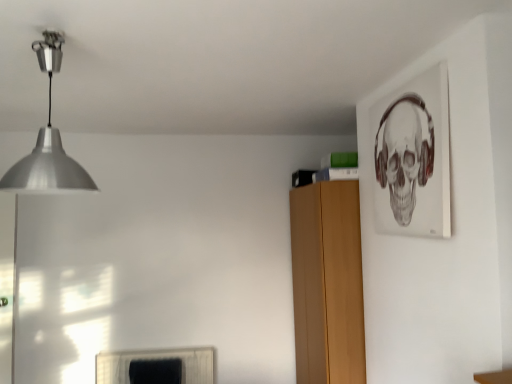
Question: Is matte paper skull at upper right spatially inside silver metallic pendant light at upper left, or outside of it?

Choices:
 (A) inside
 (B) outside

Answer: (B)

Question: From a real-world perspective, relative to silver metallic pendant light at upper left, is matte paper skull at upper right vertically above or below?

Choices:
 (A) below
 (B) above

Answer: (A)

Question: Considering the positions of point (428, 119) and point (61, 180), is point (428, 119) closer or farther from the camera than point (61, 180)?

Choices:
 (A) closer
 (B) farther

Answer: (B)

Question: From a real-world perspective, is silver metallic pendant light at upper left positioned above or below matte paper skull at upper right?

Choices:
 (A) above
 (B) below

Answer: (A)

Question: Which is correct: silver metallic pendant light at upper left is inside matte paper skull at upper right, or outside of it?

Choices:
 (A) inside
 (B) outside

Answer: (B)

Question: Is silver metallic pendant light at upper left wider or thinner than matte paper skull at upper right?

Choices:
 (A) wide
 (B) thin

Answer: (A)

Question: Is point (52, 144) positioned closer to the camera than point (402, 185)?

Choices:
 (A) closer
 (B) farther

Answer: (A)